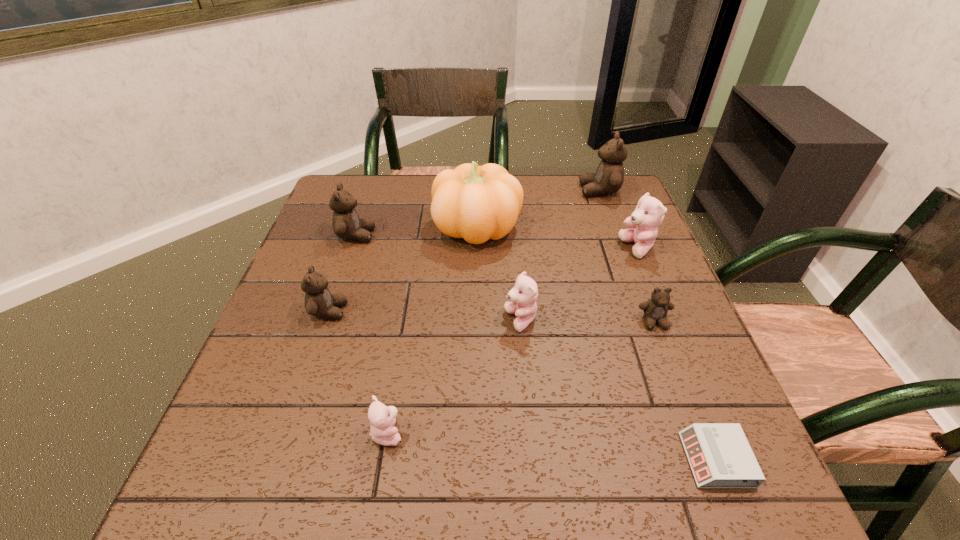
At what (x,y) coordinates should I click in order to perform the action: click on free space between the biggest pink teddy bear and the shortest object. Please return your answer as a coordinate pair (x, y). The width and height of the screenshot is (960, 540). Looking at the image, I should click on (677, 354).

Identify which object is the second nearest to the second smallest pink teddy bear. Please provide its 2D coordinates. Your answer should be formatted as a tuple, i.e. [(x, y)], where the tuple contains the x and y coordinates of a point satisfying the conditions above.

[(655, 309)]

Locate which object is the sixth closest to the second biggest pink teddy bear. Please provide its 2D coordinates. Your answer should be formatted as a tuple, i.e. [(x, y)], where the tuple contains the x and y coordinates of a point satisfying the conditions above.

[(319, 301)]

Locate which teddy bear is the fourth closest to the third nearest brown teddy bear. Please provide its 2D coordinates. Your answer should be formatted as a tuple, i.e. [(x, y)], where the tuple contains the x and y coordinates of a point satisfying the conditions above.

[(609, 177)]

Find the location of a particular element. The width and height of the screenshot is (960, 540). teddy bear that is the seventh closest to the alarm clock is located at coordinates (346, 224).

Identify the location of brown teddy bear that can be found as the fourth closest to the second nearest pink teddy bear. (609, 177).

Where is `brown teddy bear that is the closest to the smallest brown teddy bear`? The image size is (960, 540). brown teddy bear that is the closest to the smallest brown teddy bear is located at coordinates click(609, 177).

You are a GUI agent. You are given a task and a screenshot of the screen. Output one action in this format:
    pyautogui.click(x=<x>, y=<y>)
    Task: Click on the pink teddy bear that is the closest to the alarm clock
    
    Given the screenshot: What is the action you would take?
    pyautogui.click(x=523, y=296)

The image size is (960, 540). Find the location of `pink teddy bear that is the closest to the nearest pink teddy bear`. pink teddy bear that is the closest to the nearest pink teddy bear is located at coordinates (523, 296).

Find the location of a particular element. The width and height of the screenshot is (960, 540). vacant space that satisfies the following two spatial constraints: 1. at the face of the nearest pink teddy bear; 2. on the right side of the alarm clock is located at coordinates (383, 460).